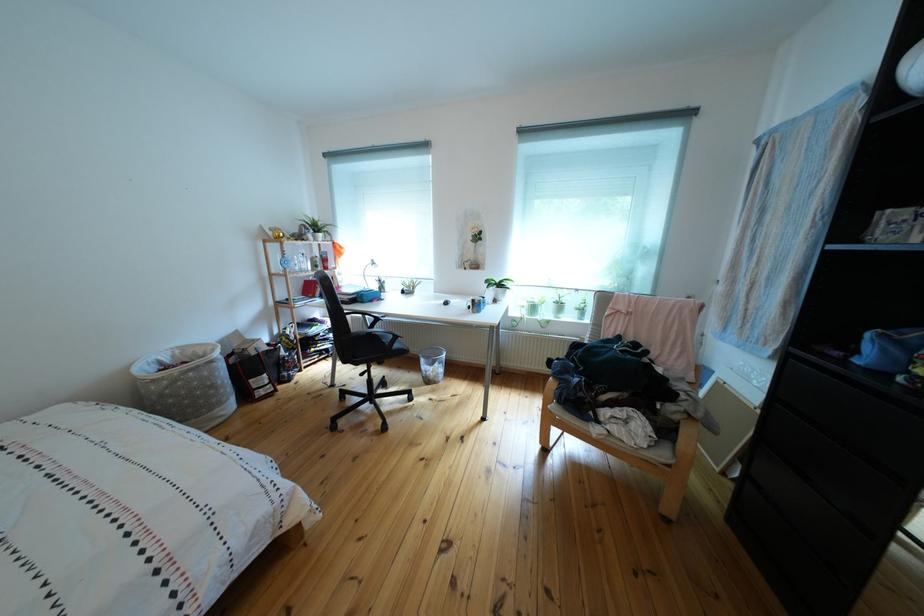
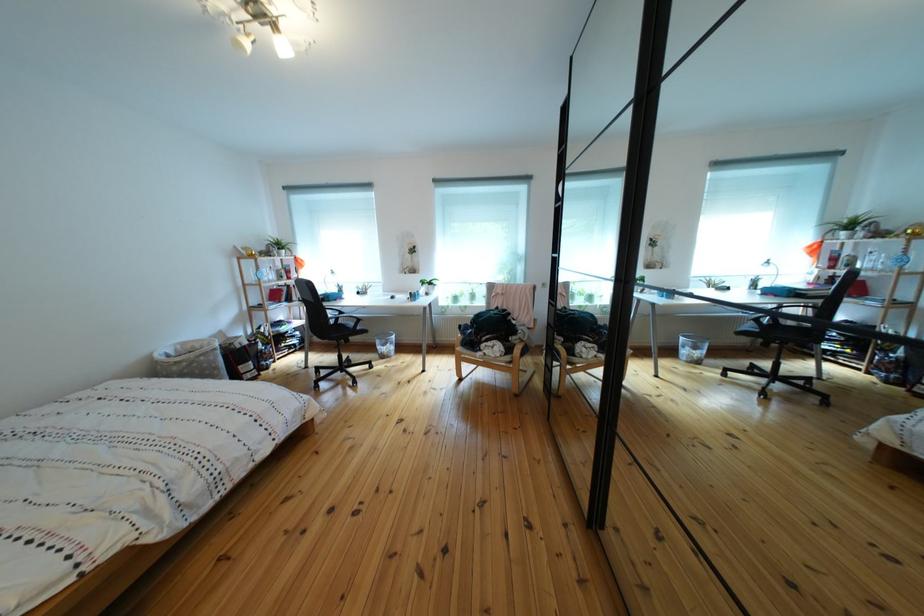
Where in the second image is the point corresponding to [185,362] from the first image?

(187, 355)